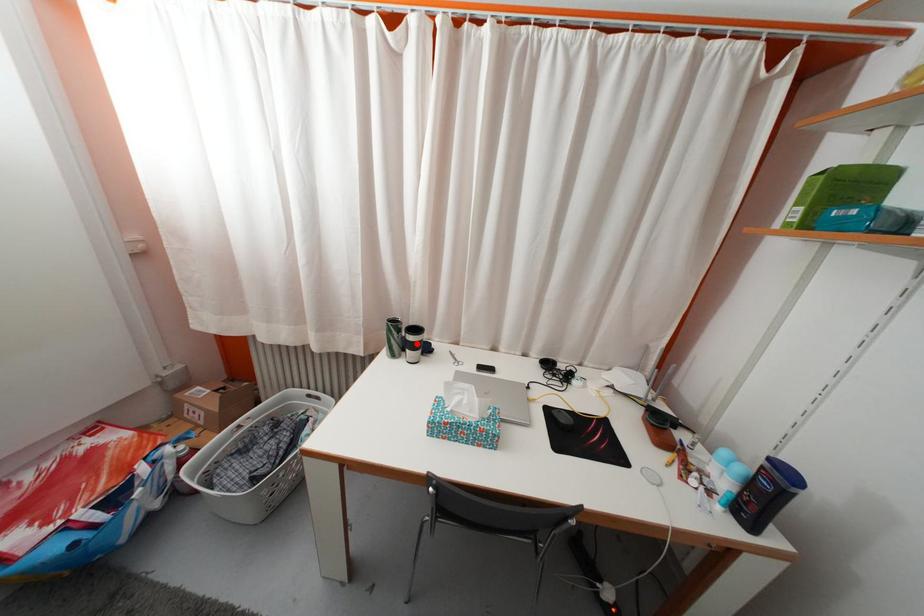
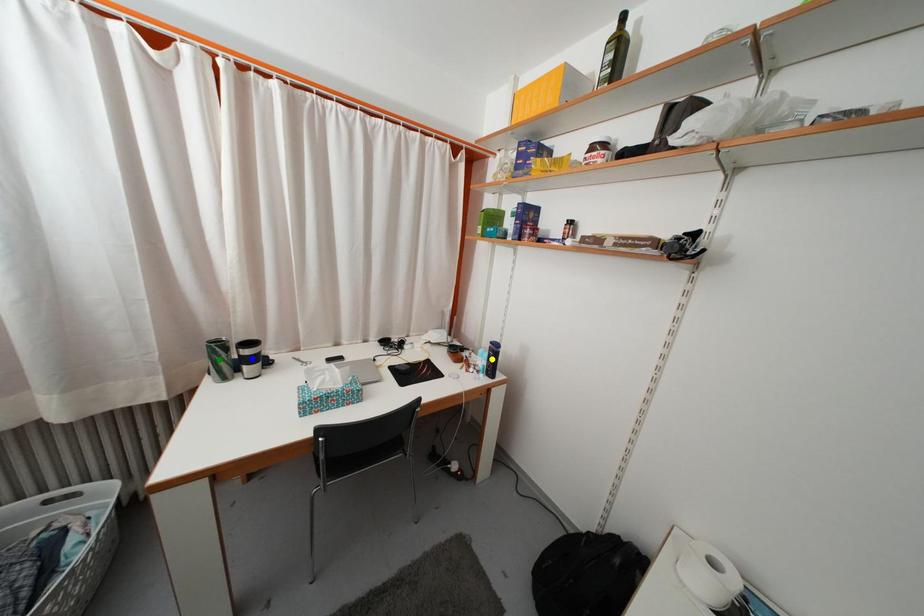
Question: I am providing you with two images of the same scene from different viewpoints. A red point is marked on the first image. You are given multiple points on the second image. Which point in image 2 represents the same 3d spot as the red point in image 1?

Choices:
 (A) green point
 (B) blue point
 (C) yellow point

Answer: (B)